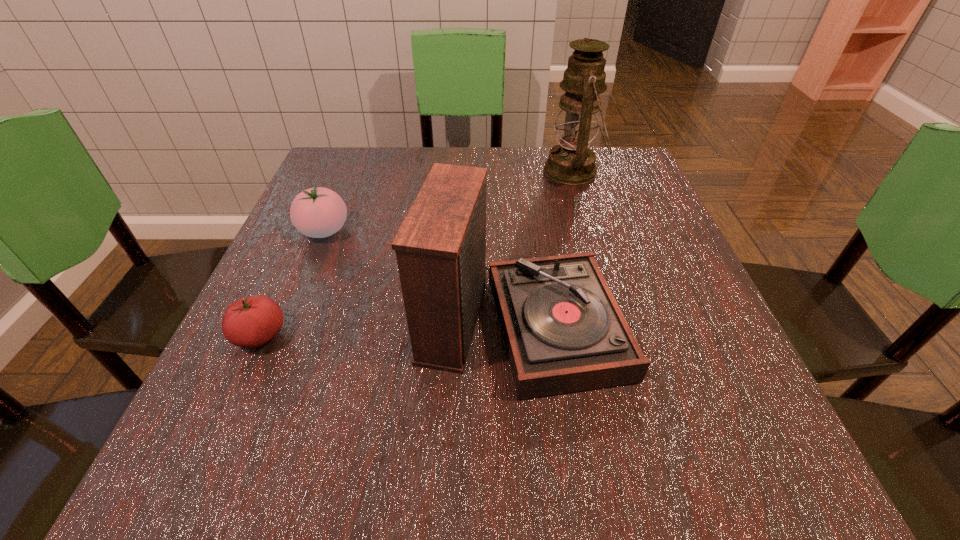
Find the location of a particular element. The height and width of the screenshot is (540, 960). vacant space located 0.090m on the front of the shortest object is located at coordinates (226, 412).

Identify the location of object that is at the far edge. (572, 162).

Locate an element on the screen. Image resolution: width=960 pixels, height=540 pixels. oil lamp that is at the right edge is located at coordinates (572, 162).

Find the location of a particular element. The width and height of the screenshot is (960, 540). phonograph record at the right edge is located at coordinates (564, 332).

Where is `object at the far right corner`? object at the far right corner is located at coordinates (572, 162).

The width and height of the screenshot is (960, 540). I want to click on blank space at the far edge of the desktop, so click(548, 197).

Locate an element on the screen. This screenshot has height=540, width=960. vacant space at the near edge is located at coordinates (589, 489).

Where is `vacant space at the left edge`? vacant space at the left edge is located at coordinates (359, 212).

Identify the location of vacant space at the right edge of the desktop. This screenshot has width=960, height=540. (632, 239).

Where is `free location at the far right corner of the desktop`? free location at the far right corner of the desktop is located at coordinates (621, 148).